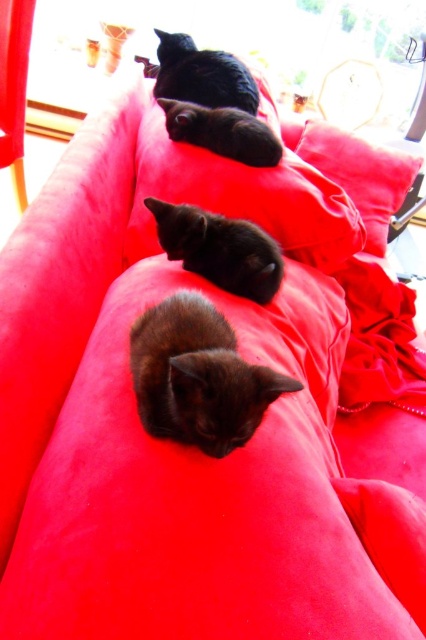
Question: Among these points, which one is farthest from the camera?

Choices:
 (A) (247, 364)
 (B) (190, 48)
 (C) (399, 163)

Answer: (C)

Question: Can you confirm if black velvet cat at center is bigger than shiny black cat at center?

Choices:
 (A) yes
 (B) no

Answer: (B)

Question: Which object is the closest to the shiny black cat at center?

Choices:
 (A) shiny black cat at upper center
 (B) black velvet cat at center
 (C) shiny black cat at lower center
 (D) velvet cushion at center

Answer: (A)

Question: Is shiny black cat at lower center positioned in front of black velvet cat at center?

Choices:
 (A) no
 (B) yes

Answer: (B)

Question: Which object is the farthest from the velvet cushion at center?

Choices:
 (A) shiny black cat at center
 (B) black velvet cat at center
 (C) shiny black cat at upper center
 (D) shiny black cat at lower center

Answer: (D)

Question: Does shiny black cat at lower center appear on the right side of shiny black cat at upper center?

Choices:
 (A) yes
 (B) no

Answer: (A)